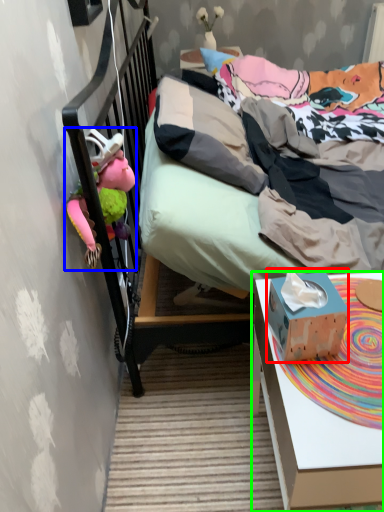
Question: Based on their relative distances, which object is nearer to box (highlighted by a red box)? Choose from toy (highlighted by a blue box) and desk (highlighted by a green box).

Choices:
 (A) toy
 (B) desk

Answer: (B)